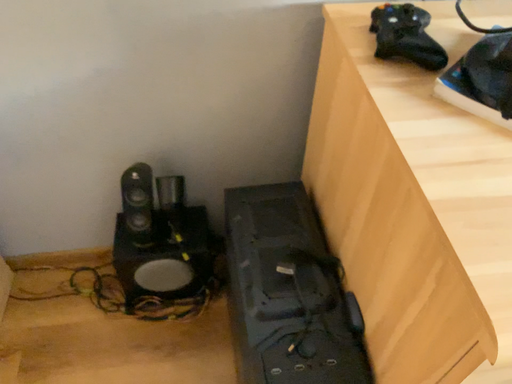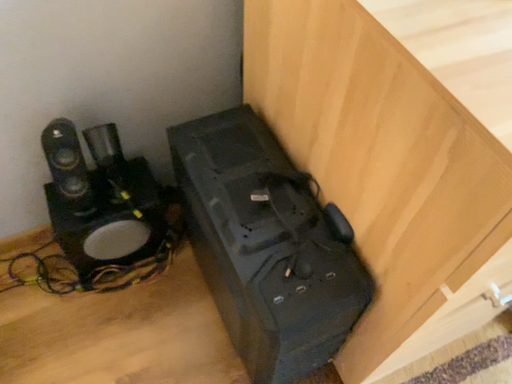
Question: Which way did the camera rotate in the video?

Choices:
 (A) rotated left
 (B) rotated right

Answer: (B)